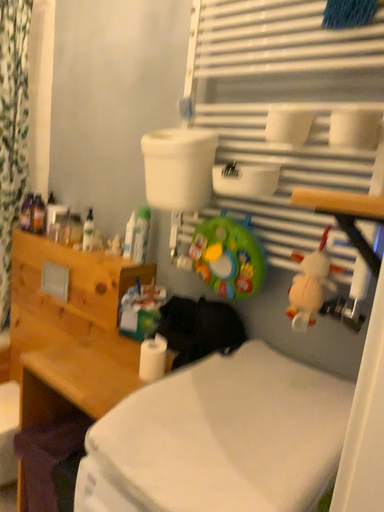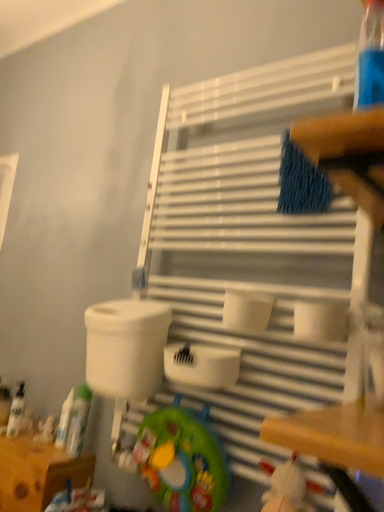
Question: How did the camera likely rotate when shooting the video?

Choices:
 (A) rotated upward
 (B) rotated downward

Answer: (A)